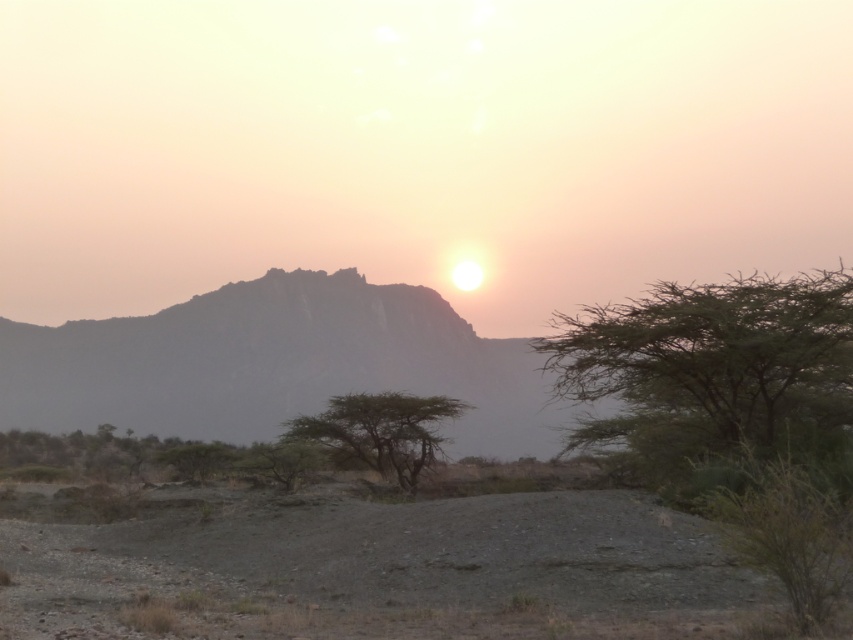
Is gray gravelly dirt field at lower center positioned behind green leafy tree at right?

No.

Is gray gravelly dirt field at lower center positioned before green leafy tree at right?

Yes, it is in front of green leafy tree at right.

Between point (498, 516) and point (766, 342), which one is positioned in front?

Point (498, 516) is more forward.

This screenshot has height=640, width=853. In order to click on gray gravelly dirt field at lower center in this screenshot , I will do `click(383, 570)`.

Is green leafy tree at right smaller than green matte tree at center?

No.

Describe the element at coordinates (711, 369) in the screenshot. The height and width of the screenshot is (640, 853). I see `green leafy tree at right` at that location.

The width and height of the screenshot is (853, 640). Find the location of `green leafy tree at right`. green leafy tree at right is located at coordinates (711, 369).

Is gray gravelly dirt field at lower center positioned behind green matte tree at center?

No.

Does point (486, 497) come behind point (303, 419)?

No.

What do you see at coordinates (383, 570) in the screenshot? I see `gray gravelly dirt field at lower center` at bounding box center [383, 570].

Locate an element on the screen. The image size is (853, 640). gray gravelly dirt field at lower center is located at coordinates (383, 570).